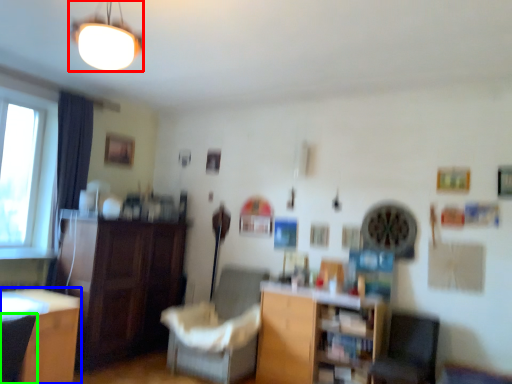
Question: Estimate the real-world distances between objects in this image. Which object is farther from lamp (highlighted by a red box), desk (highlighted by a blue box) or armchair (highlighted by a green box)?

Choices:
 (A) desk
 (B) armchair

Answer: (A)